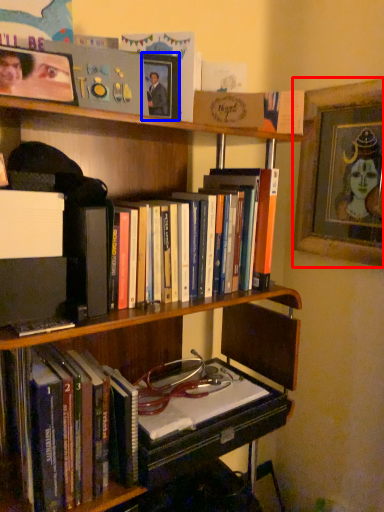
Question: Which object appears closest to the camera in this image, picture frame (highlighted by a red box) or picture frame (highlighted by a blue box)?

Choices:
 (A) picture frame
 (B) picture frame

Answer: (B)